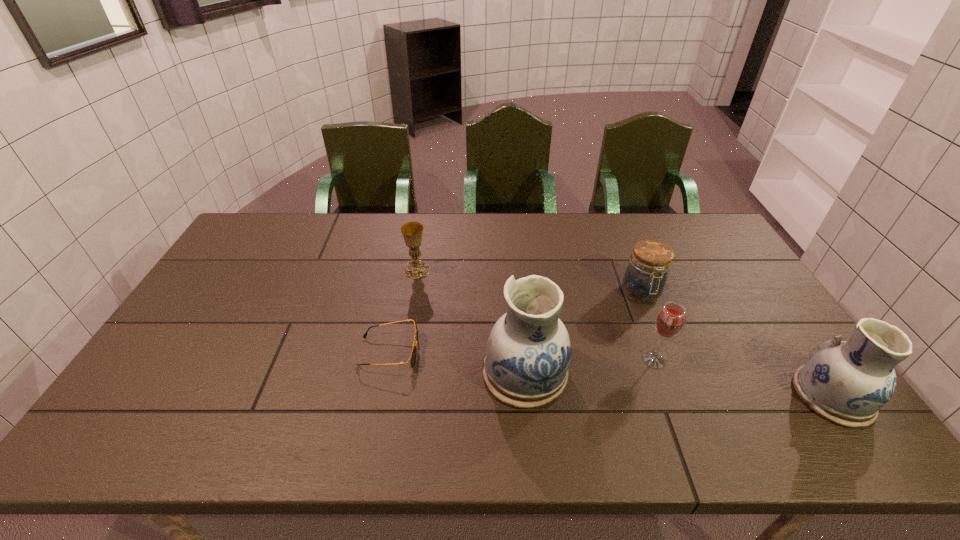
Please point a spot on the left to add another pottery. Please provide its 2D coordinates. Your answer should be formatted as a tuple, i.e. [(x, y)], where the tuple contains the x and y coordinates of a point satisfying the conditions above.

[(245, 350)]